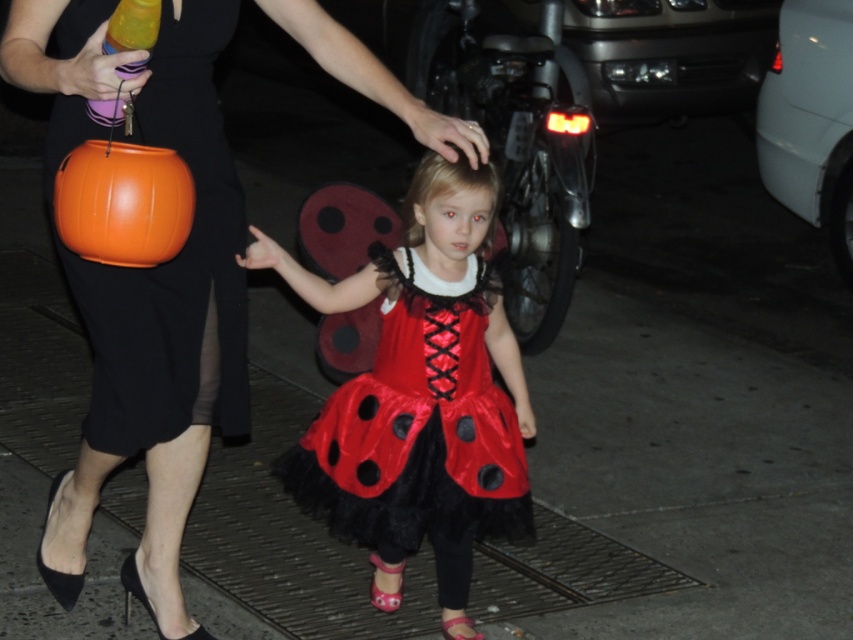
Question: Which is nearer to the shiny satin dress at center?

Choices:
 (A) orange matte pumpkin at left
 (B) orange plastic bucket at left
 (C) matte black dress at center

Answer: (C)

Question: Is matte black dress at center below orange plastic bucket at left?

Choices:
 (A) yes
 (B) no

Answer: (A)

Question: Which of the following is the farthest from the observer?

Choices:
 (A) matte black dress at center
 (B) orange matte pumpkin at left
 (C) shiny satin dress at center

Answer: (C)

Question: Is matte black dress at center wider than orange plastic bucket at left?

Choices:
 (A) yes
 (B) no

Answer: (A)

Question: Which point is closer to the camera?

Choices:
 (A) (97, 218)
 (B) (479, 312)
 (C) (161, 412)

Answer: (A)

Question: Is matte black dress at center thinner than orange matte pumpkin at left?

Choices:
 (A) no
 (B) yes

Answer: (A)